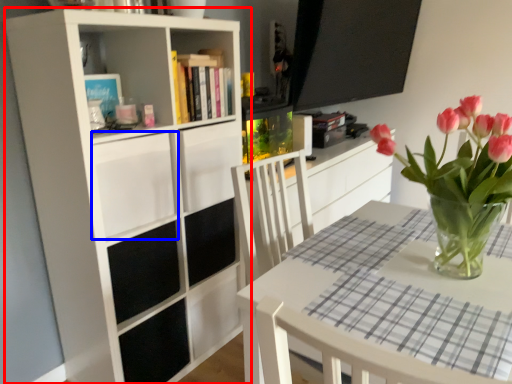
Question: Which point is further to the camera, bookcase (highlighted by a red box) or drawer (highlighted by a blue box)?

Choices:
 (A) bookcase
 (B) drawer

Answer: (B)